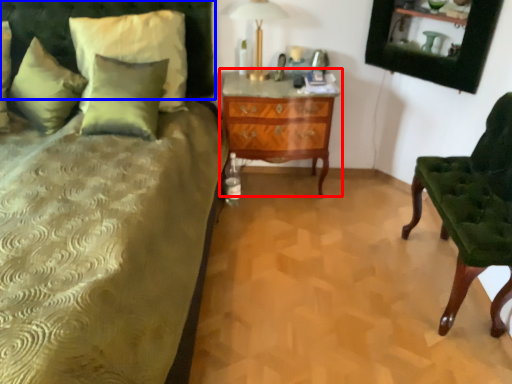
Question: Which point is closer to the camera, nightstand (highlighted by a red box) or headboard (highlighted by a blue box)?

Choices:
 (A) nightstand
 (B) headboard

Answer: (B)